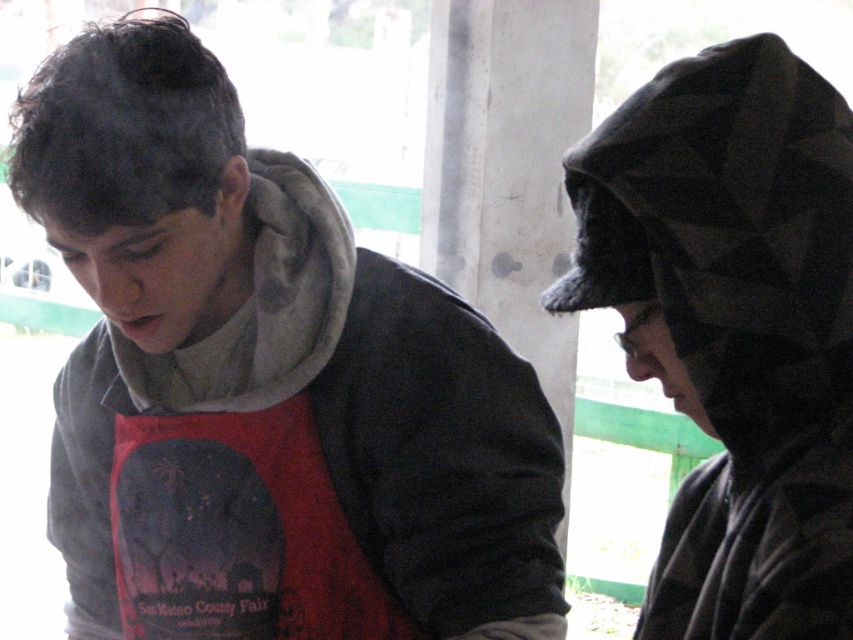
The height and width of the screenshot is (640, 853). What do you see at coordinates (265, 384) in the screenshot? I see `matte gray hoodie at center` at bounding box center [265, 384].

Does point (343, 532) lie behind point (802, 552)?

Yes, point (343, 532) is farther from viewer.

Locate an element on the screen. This screenshot has height=640, width=853. matte gray hoodie at center is located at coordinates (265, 384).